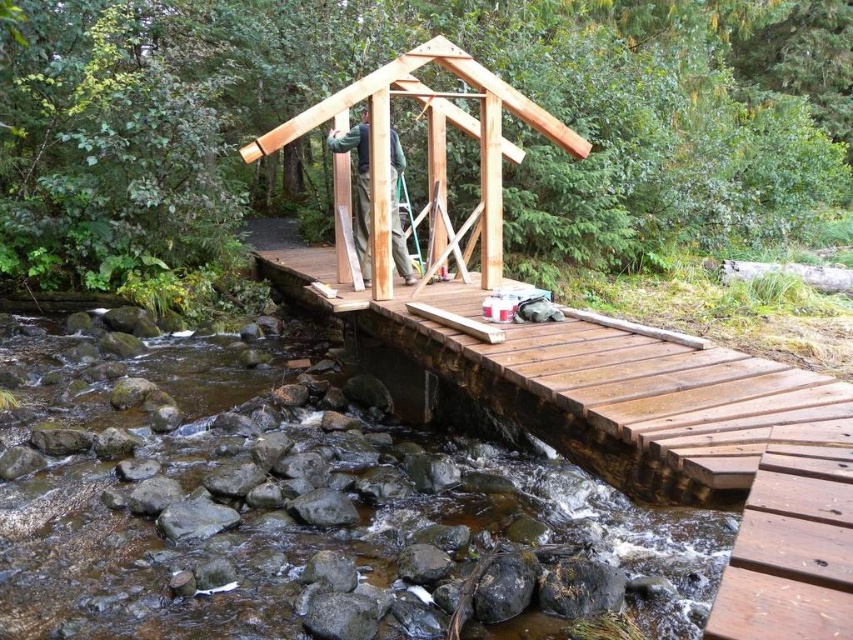
You are planning to install a new lighting system on the natural wood bridge at center and the natural wood cabin at center. Based on their heights, which structure will require a taller ladder for the installation work?

The natural wood cabin at center requires a taller ladder because it has a greater height than the natural wood bridge at center.

You are a contractor planning to transport a 10 feet long wooden beam from the natural wood cabin at center to the natural wood bridge at center. Based on the scene, can you safely move the beam without bending it? Explain your reasoning.

The natural wood bridge at center is 8.16 feet from the natural wood cabin at center. Since the beam is 10 feet long, which is longer than the distance between them, you cannot safely move the beam without bending it.